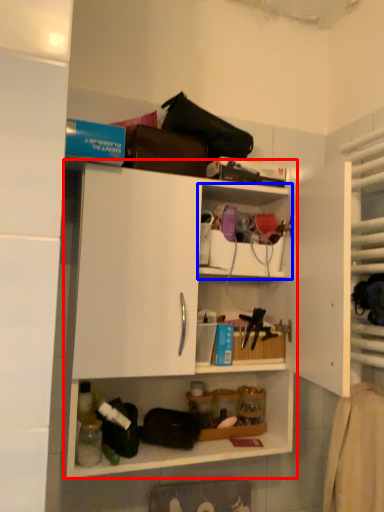
Question: Which of the following is the farthest to the observer, shelf (highlighted by a red box) or shelf (highlighted by a blue box)?

Choices:
 (A) shelf
 (B) shelf

Answer: (B)